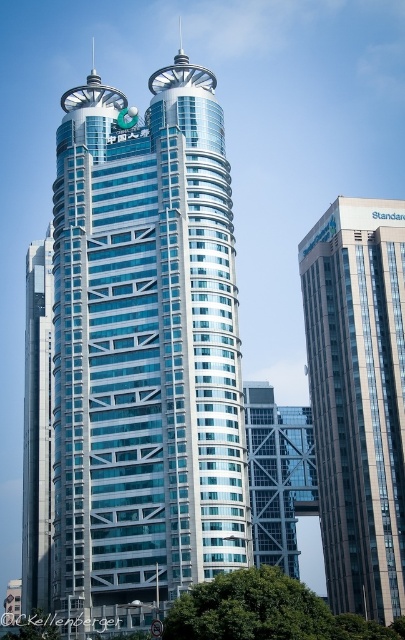
Between glassy metallic skyscraper at center and glassy steel skyscraper at left, which one has less height?

glassy steel skyscraper at left is shorter.

Can you confirm if glassy metallic skyscraper at center is positioned to the left of glassy steel skyscraper at left?

Incorrect, glassy metallic skyscraper at center is not on the left side of glassy steel skyscraper at left.

Which is in front, point (117, 177) or point (25, 426)?

Point (117, 177) is more forward.

Where is `glassy metallic skyscraper at center`? This screenshot has height=640, width=405. glassy metallic skyscraper at center is located at coordinates (144, 349).

Between glassy metallic skyscraper at center and matte glass building at right, which one appears on the right side from the viewer's perspective?

From the viewer's perspective, matte glass building at right appears more on the right side.

Can you confirm if glassy metallic skyscraper at center is smaller than matte glass building at right?

Actually, glassy metallic skyscraper at center might be larger than matte glass building at right.

You are a GUI agent. You are given a task and a screenshot of the screen. Output one action in this format:
    pyautogui.click(x=<x>, y=<y>)
    Task: Click on the glassy metallic skyscraper at center
    The width and height of the screenshot is (405, 640).
    Given the screenshot: What is the action you would take?
    pyautogui.click(x=144, y=349)

Based on the photo, is matte glass building at right in front of glassy steel skyscraper at left?

No, it is behind glassy steel skyscraper at left.

Does point (324, 548) lie in front of point (38, 275)?

Yes.

I want to click on matte glass building at right, so click(x=358, y=397).